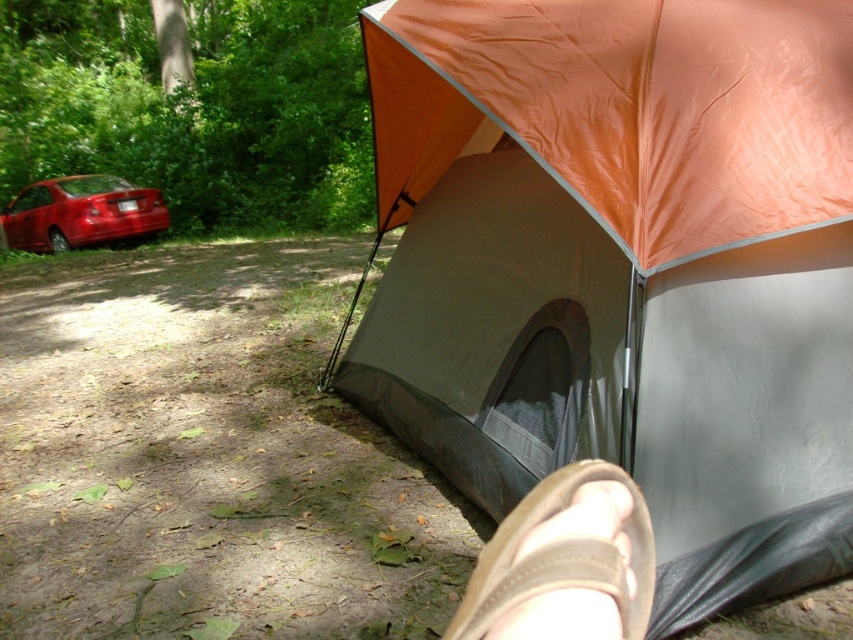
Question: Considering the real-world distances, which object is closest to the glossy red sedan at left?

Choices:
 (A) orange tarpaulin tent at center
 (B) brown suede sandal at lower right

Answer: (A)

Question: Based on their relative distances, which object is farther from the glossy red sedan at left?

Choices:
 (A) orange tarpaulin tent at center
 (B) orange tarpaulin tent at upper right
 (C) brown suede sandal at lower right

Answer: (C)

Question: Where is orange tarpaulin tent at upper right located in relation to brown suede sandal at lower right in the image?

Choices:
 (A) left
 (B) right

Answer: (B)

Question: Does brown suede sandal at lower right appear on the right side of glossy red sedan at left?

Choices:
 (A) yes
 (B) no

Answer: (A)

Question: Which is farther from the brown suede sandal at lower right?

Choices:
 (A) orange tarpaulin tent at center
 (B) orange tarpaulin tent at upper right
 (C) glossy red sedan at left

Answer: (C)

Question: Considering the relative positions of orange tarpaulin tent at center and orange tarpaulin tent at upper right in the image provided, where is orange tarpaulin tent at center located with respect to orange tarpaulin tent at upper right?

Choices:
 (A) below
 (B) above

Answer: (A)